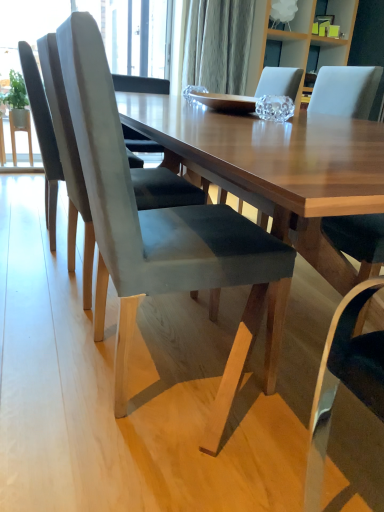
The image size is (384, 512). I want to click on suede gray chair at left, which is the second chair in back-to-front order, so click(68, 159).

What is the approximate height of wooden table at center?

It is 3.07 inches.

In order to click on suede gray chair at center, acting as the third chair starting from the back in this screenshot , I will do `click(163, 234)`.

The width and height of the screenshot is (384, 512). Find the location of `suede gray chair at left, which is the second chair in back-to-front order`. suede gray chair at left, which is the second chair in back-to-front order is located at coordinates (68, 159).

Is suede gray chair at center, acting as the third chair starting from the back, oriented away from suede gray chair at left, acting as the 1th chair starting from the back?

No, suede gray chair at center, acting as the third chair starting from the back, is not facing the opposite direction of suede gray chair at left, acting as the 1th chair starting from the back.

From the image's perspective, between suede gray chair at center, which is the 1th chair in front-to-back order, and suede gray chair at left, acting as the 1th chair starting from the back, which one is located above?

From the image's view, suede gray chair at left, acting as the 1th chair starting from the back, is above.

From the picture: Which object is closer to the camera taking this photo, suede gray chair at center, acting as the third chair starting from the back, or suede gray chair at left, acting as the 1th chair starting from the back?

suede gray chair at center, acting as the third chair starting from the back, is more forward.

Does point (280, 245) come behind point (24, 57)?

No, it is in front of (24, 57).

Based on the photo, does suede gray chair at left, acting as the 1th chair starting from the back, turn towards suede gray chair at center, which is the 1th chair in front-to-back order?

No, suede gray chair at left, acting as the 1th chair starting from the back, is not aimed at suede gray chair at center, which is the 1th chair in front-to-back order.

Would you say suede gray chair at center, which is the 1th chair in front-to-back order, is part of suede gray chair at left, acting as the 1th chair starting from the back,'s contents?

No, suede gray chair at center, which is the 1th chair in front-to-back order, is not inside suede gray chair at left, acting as the 1th chair starting from the back.

Find the location of `the 2nd chair to the right of the suede gray chair at left, which is the 3th chair from front to back, counting from the anchor's position`. the 2nd chair to the right of the suede gray chair at left, which is the 3th chair from front to back, counting from the anchor's position is located at coordinates (163, 234).

Considering their positions, is suede gray chair at left, acting as the 1th chair starting from the back, located in front of or behind suede gray chair at center, acting as the third chair starting from the back?

Visually, suede gray chair at left, acting as the 1th chair starting from the back, is located behind suede gray chair at center, acting as the third chair starting from the back.

How much distance is there between suede gray chair at left, which is the 3th chair from front to back, and suede gray chair at left, which is the second chair in back-to-front order?

The distance of suede gray chair at left, which is the 3th chair from front to back, from suede gray chair at left, which is the second chair in back-to-front order, is 10.51 inches.

Is suede gray chair at left, acting as the 1th chair starting from the back, completely or partially outside of suede gray chair at left, arranged as the 2th chair when viewed from the front?

Yes, suede gray chair at left, acting as the 1th chair starting from the back, is not within suede gray chair at left, arranged as the 2th chair when viewed from the front.

Between suede gray chair at left, which is the 3th chair from front to back, and suede gray chair at left, arranged as the 2th chair when viewed from the front, which one has smaller size?

Smaller between the two is suede gray chair at left, which is the 3th chair from front to back.

Considering the sizes of objects suede gray chair at left, acting as the 1th chair starting from the back, and suede gray chair at left, arranged as the 2th chair when viewed from the front, in the image provided, who is taller, suede gray chair at left, acting as the 1th chair starting from the back, or suede gray chair at left, arranged as the 2th chair when viewed from the front,?

Standing taller between the two is suede gray chair at left, arranged as the 2th chair when viewed from the front.

From a real-world perspective, who is located higher, suede gray chair at left, acting as the 1th chair starting from the back, or wooden table at center?

suede gray chair at left, acting as the 1th chair starting from the back, from a real-world perspective.

Is suede gray chair at left, which is the 3th chair from front to back, with wooden table at center?

No, suede gray chair at left, which is the 3th chair from front to back, is not next to wooden table at center.

Does suede gray chair at left, which is the 3th chair from front to back, have a smaller size compared to wooden table at center?

Correct, suede gray chair at left, which is the 3th chair from front to back, occupies less space than wooden table at center.

Which object is closer to the camera taking this photo, suede gray chair at left, which is the second chair in back-to-front order, or wooden table at center?

Positioned in front is wooden table at center.

Could you tell me if suede gray chair at left, which is the second chair in back-to-front order, is turned towards wooden table at center?

No, suede gray chair at left, which is the second chair in back-to-front order, is not aimed at wooden table at center.

Could you measure the distance between suede gray chair at left, arranged as the 2th chair when viewed from the front, and wooden table at center?

They are 17.70 inches apart.

Looking at the image, does suede gray chair at left, which is the second chair in back-to-front order, seem bigger or smaller compared to wooden table at center?

Clearly, suede gray chair at left, which is the second chair in back-to-front order, is smaller in size than wooden table at center.

From a real-world perspective, between wooden table at center and suede gray chair at center, which is the 1th chair in front-to-back order, who is vertically higher?

suede gray chair at center, which is the 1th chair in front-to-back order.

Considering the sizes of objects wooden table at center and suede gray chair at center, acting as the third chair starting from the back, in the image provided, who is smaller, wooden table at center or suede gray chair at center, acting as the third chair starting from the back,?

With smaller size is suede gray chair at center, acting as the third chair starting from the back.

Looking at this image, is wooden table at center positioned far away from suede gray chair at center, acting as the third chair starting from the back?

wooden table at center is actually quite close to suede gray chair at center, acting as the third chair starting from the back.

Does suede gray chair at left, which is the second chair in back-to-front order, come in front of suede gray chair at left, which is the 3th chair from front to back?

Yes, suede gray chair at left, which is the second chair in back-to-front order, is in front of suede gray chair at left, which is the 3th chair from front to back.

From a real-world perspective, is suede gray chair at left, arranged as the 2th chair when viewed from the front, physically located above or below suede gray chair at left, which is the 3th chair from front to back?

From a real-world perspective, suede gray chair at left, arranged as the 2th chair when viewed from the front, is physically above suede gray chair at left, which is the 3th chair from front to back.

Considering the sizes of suede gray chair at left, which is the second chair in back-to-front order, and suede gray chair at left, acting as the 1th chair starting from the back, in the image, is suede gray chair at left, which is the second chair in back-to-front order, taller or shorter than suede gray chair at left, acting as the 1th chair starting from the back,?

Considering their sizes, suede gray chair at left, which is the second chair in back-to-front order, has more height than suede gray chair at left, acting as the 1th chair starting from the back.

Between suede gray chair at left, which is the second chair in back-to-front order, and suede gray chair at left, which is the 3th chair from front to back, which one has larger width?

With larger width is suede gray chair at left, which is the second chair in back-to-front order.

Starting from the suede gray chair at center, acting as the third chair starting from the back, which chair is the 2nd one to the left? Please provide its 2D coordinates.

[(43, 135)]

From a real-world perspective, which chair is the 1st one above the suede gray chair at center, acting as the third chair starting from the back? Please provide its 2D coordinates.

[(43, 135)]

Estimate the real-world distances between objects in this image. Which object is closer to wooden table at center, suede gray chair at left, arranged as the 2th chair when viewed from the front, or suede gray chair at center, acting as the third chair starting from the back?

Among the two, suede gray chair at center, acting as the third chair starting from the back, is located nearer to wooden table at center.

Looking at the image, which one is located closer to suede gray chair at left, which is the 3th chair from front to back, suede gray chair at left, arranged as the 2th chair when viewed from the front, or wooden table at center?

suede gray chair at left, arranged as the 2th chair when viewed from the front, is positioned closer to the anchor suede gray chair at left, which is the 3th chair from front to back.

When comparing their distances from wooden table at center, does suede gray chair at center, acting as the third chair starting from the back, or suede gray chair at left, arranged as the 2th chair when viewed from the front, seem closer?

suede gray chair at center, acting as the third chair starting from the back, is positioned closer to the anchor wooden table at center.

Based on the photo, when comparing their distances from suede gray chair at center, which is the 1th chair in front-to-back order, does wooden table at center or suede gray chair at left, which is the 3th chair from front to back, seem closer?

Based on the image, wooden table at center appears to be nearer to suede gray chair at center, which is the 1th chair in front-to-back order.

Which object lies nearer to the anchor point suede gray chair at left, which is the 3th chair from front to back, wooden table at center or suede gray chair at center, acting as the third chair starting from the back?

→ Among the two, suede gray chair at center, acting as the third chair starting from the back, is located nearer to suede gray chair at left, which is the 3th chair from front to back.

Looking at the image, which one is located closer to suede gray chair at left, arranged as the 2th chair when viewed from the front, wooden table at center or suede gray chair at center, which is the 1th chair in front-to-back order?

suede gray chair at center, which is the 1th chair in front-to-back order.

Considering their positions, is suede gray chair at center, acting as the third chair starting from the back, positioned further to suede gray chair at left, acting as the 1th chair starting from the back, than suede gray chair at left, arranged as the 2th chair when viewed from the front?

suede gray chair at center, acting as the third chair starting from the back, lies further to suede gray chair at left, acting as the 1th chair starting from the back, than the other object.

Which object lies further to the anchor point wooden table at center, suede gray chair at left, which is the 3th chair from front to back, or suede gray chair at center, acting as the third chair starting from the back?

suede gray chair at left, which is the 3th chair from front to back, is further to wooden table at center.

Locate an element on the screen. The image size is (384, 512). chair between wooden table at center and suede gray chair at left, which is the second chair in back-to-front order, from front to back is located at coordinates (163, 234).

Image resolution: width=384 pixels, height=512 pixels. What are the coordinates of `chair positioned between suede gray chair at center, acting as the third chair starting from the back, and suede gray chair at left, acting as the 1th chair starting from the back, from near to far` in the screenshot? It's located at (68, 159).